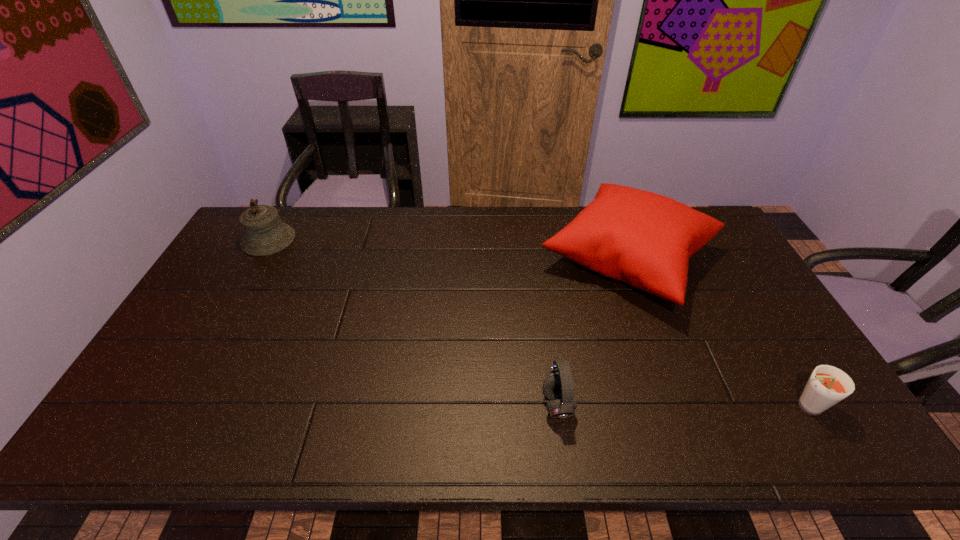
Locate an element on the screen. cushion is located at coordinates (645, 239).

This screenshot has width=960, height=540. I want to click on the leftmost object, so click(x=264, y=233).

This screenshot has width=960, height=540. In order to click on root beer in this screenshot , I will do `click(827, 386)`.

Where is `headset`? headset is located at coordinates (558, 387).

At what (x,y) coordinates should I click in order to perform the action: click on vacant space located on the front of the cushion. Please return your answer as a coordinate pair (x, y). This screenshot has height=540, width=960. Looking at the image, I should click on (701, 448).

Where is `free space located on the back of the leftmost object`? This screenshot has height=540, width=960. free space located on the back of the leftmost object is located at coordinates (286, 208).

Find the location of a particular element. The height and width of the screenshot is (540, 960). vacant space located on the drink side of the root beer is located at coordinates (666, 406).

Where is `free region located 0.360m on the drink side of the root beer`? This screenshot has height=540, width=960. free region located 0.360m on the drink side of the root beer is located at coordinates (633, 406).

Identify the location of vacant region located on the drink side of the root beer. (695, 406).

Find the location of a particular element. The width and height of the screenshot is (960, 540). vacant space situated 0.130m on the ear cups of the headset is located at coordinates (488, 405).